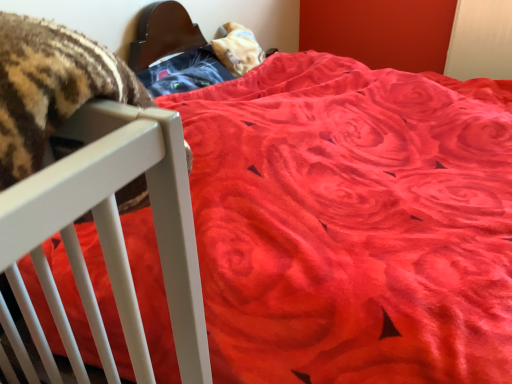
What do you see at coordinates (112, 234) in the screenshot? I see `white matte crib at left` at bounding box center [112, 234].

Locate an element on the screen. This screenshot has height=384, width=512. white matte crib at left is located at coordinates (112, 234).

Locate an element on the screen. The width and height of the screenshot is (512, 384). white matte crib at left is located at coordinates (112, 234).